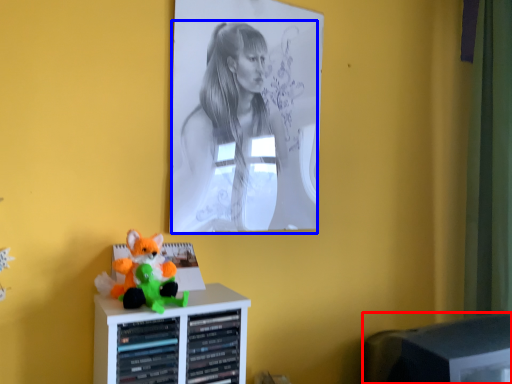
Question: Which point is closer to the camera, computer monitor (highlighted by a red box) or person (highlighted by a blue box)?

Choices:
 (A) computer monitor
 (B) person

Answer: (A)